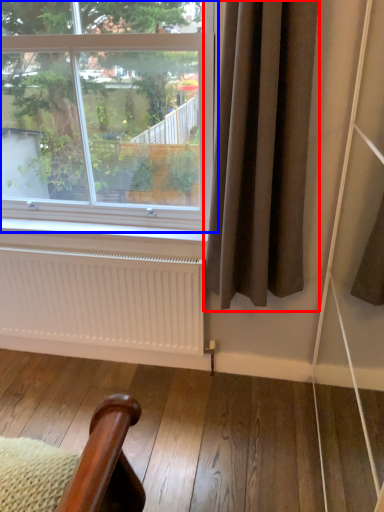
Question: Which object appears farthest to the camera in this image, curtain (highlighted by a red box) or window (highlighted by a blue box)?

Choices:
 (A) curtain
 (B) window

Answer: (B)